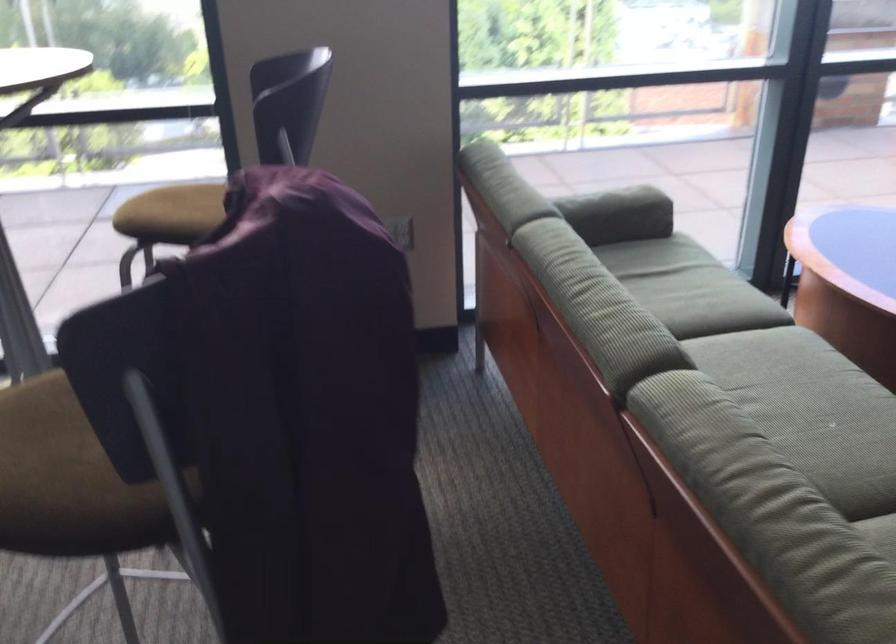
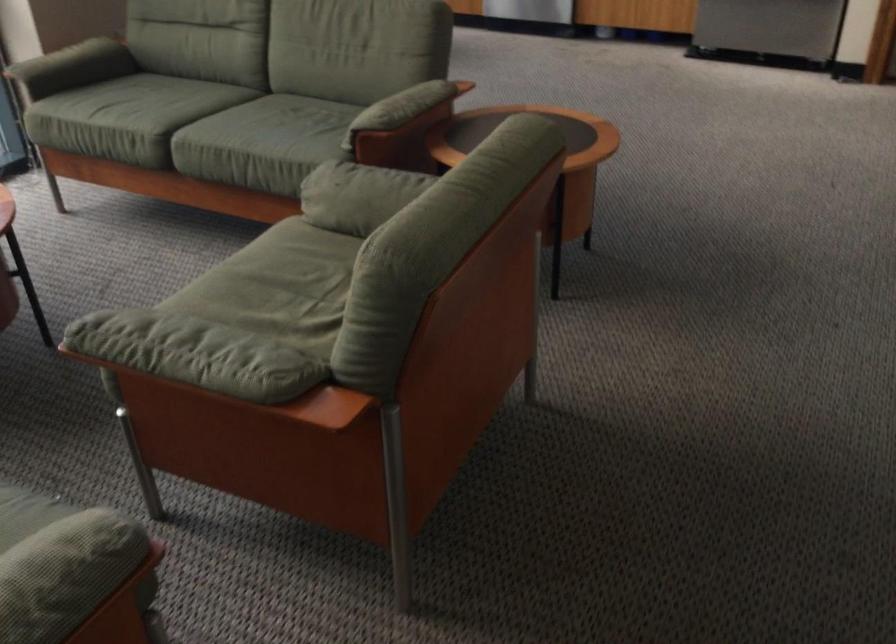
Question: The camera is either moving clockwise (left) or counter-clockwise (right) around the object. The first image is from the beginning of the video and the second image is from the end. Is the camera moving left or right when shooting the video?

Choices:
 (A) Left
 (B) Right

Answer: (A)